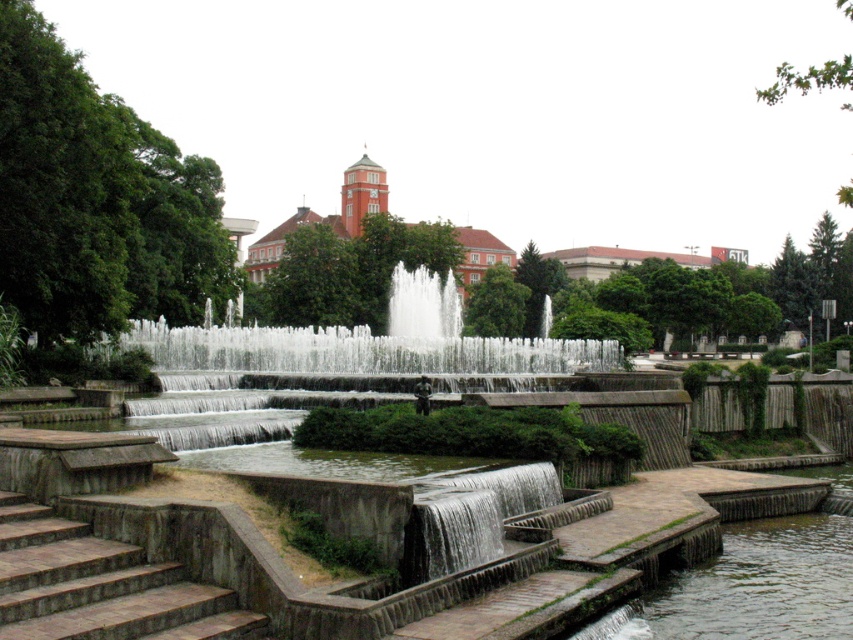
Is smooth concrete waterfall at lower center thinner than white frothy water at center?

Yes, smooth concrete waterfall at lower center is thinner than white frothy water at center.

Is smooth concrete waterfall at lower center to the right of white frothy water at center from the viewer's perspective?

Yes, smooth concrete waterfall at lower center is to the right of white frothy water at center.

Is point (473, 500) farther from viewer compared to point (457, 324)?

That is False.

This screenshot has width=853, height=640. Find the location of `smooth concrete waterfall at lower center`. smooth concrete waterfall at lower center is located at coordinates (469, 516).

Between clear concrete waterfall at center and smooth concrete waterfall at lower center, which one has more height?

clear concrete waterfall at center

Does clear concrete waterfall at center have a smaller size compared to smooth concrete waterfall at lower center?

No, clear concrete waterfall at center is not smaller than smooth concrete waterfall at lower center.

Is point (390, 353) farther from camera compared to point (524, 502)?

Yes, it is behind point (524, 502).

The height and width of the screenshot is (640, 853). Identify the location of clear concrete waterfall at center. (364, 353).

What do you see at coordinates (751, 588) in the screenshot?
I see `clear water at bottom right` at bounding box center [751, 588].

Who is more distant from viewer, (793, 515) or (444, 310)?

The point (444, 310) is behind.

You are a GUI agent. You are given a task and a screenshot of the screen. Output one action in this format:
    pyautogui.click(x=<x>, y=<y>)
    Task: Click on the clear water at bottom right
    The width and height of the screenshot is (853, 640).
    Given the screenshot: What is the action you would take?
    pyautogui.click(x=751, y=588)